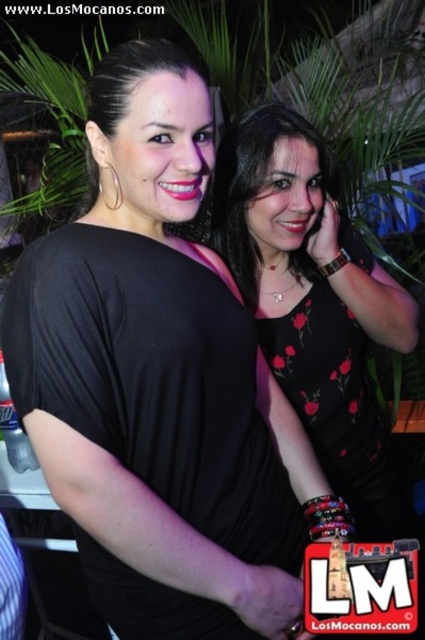
You are a photographer setting up for a photoshoot and need to ensure both the black floral dress at center and the matte black dress at center are visible in the frame. Given their widths, which dress might require more space to accommodate its width in the composition?

The black floral dress at center has a greater width than the matte black dress at center, so it would require more space to accommodate its width in the composition.

You are a photographer setting up for a photoshoot in a tropical garden at night. You have two dresses to feature in the image, the black floral dress at center and the matte black dress at center. Based on the scene description, which dress is bigger in size?

The black floral dress at center has a larger size compared to the matte black dress at center, so the black floral dress at center is bigger.